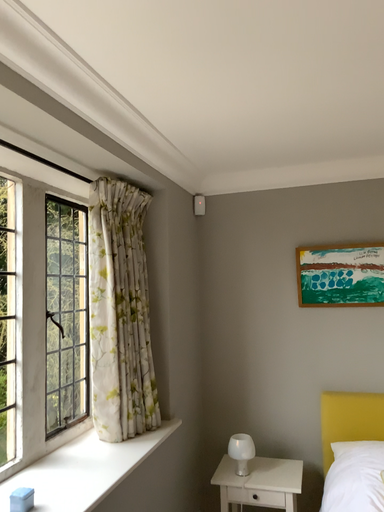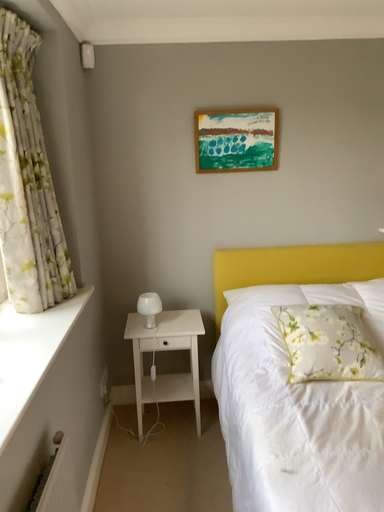
Question: How did the camera likely rotate when shooting the video?

Choices:
 (A) rotated right
 (B) rotated left

Answer: (A)